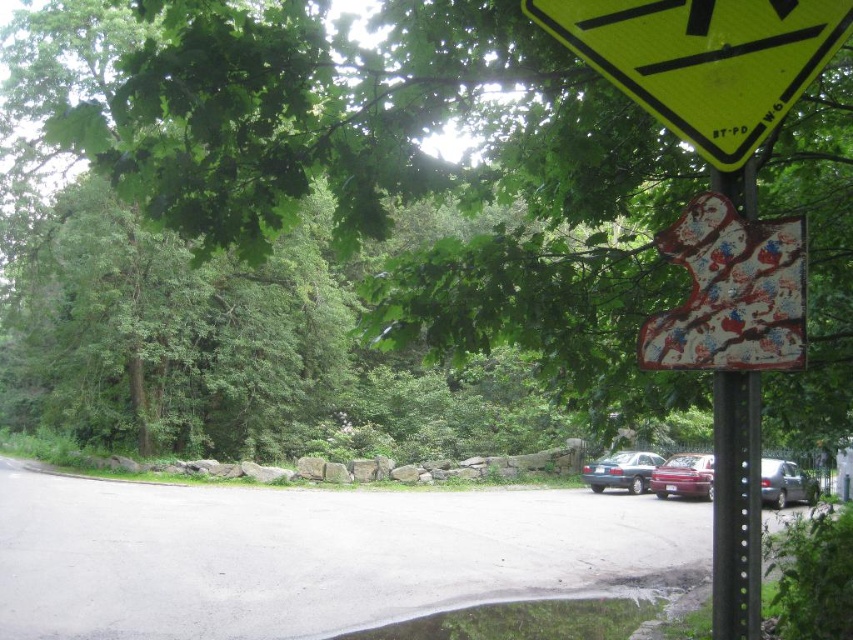
You are a delivery driver approaching the painted wooden sign at upper right and the black metal signpost at right. Your delivery van is 8 feet wide. Can you safely pass between them without touching either sign?

The painted wooden sign at upper right is 9.19 inches away from the black metal signpost at right. Since the distance between them is only 9.19 inches, which is much narrower than the van width of 8 feet, the van cannot safely pass between them without touching either sign.

You are standing at the beginning of the road and want to reach the green leafy tree at upper center. Which direction should you walk to get there?

The green leafy tree at upper center is located at point (323,227), so you should walk towards the upper center direction to reach it.

You are a hiker trying to navigate a trail and see the green leafy tree at upper center and the black metal signpost at right. Which object would you use to determine your direction?

The black metal signpost at right is smaller than the green leafy tree at upper center, so the signpost is more likely to provide directional information as it is typically smaller and placed strategically for visibility.